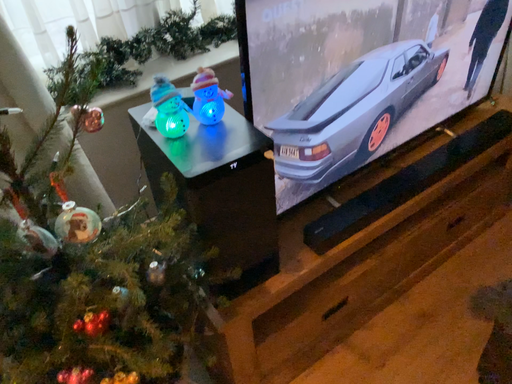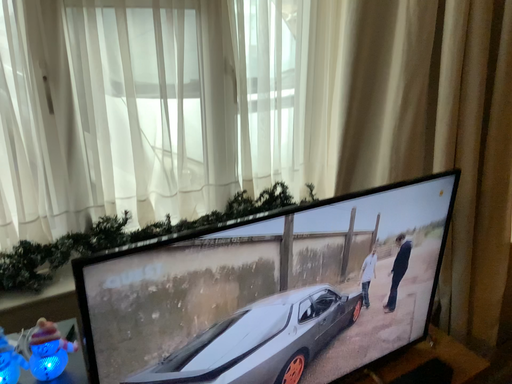
Question: How did the camera likely rotate when shooting the video?

Choices:
 (A) rotated upward
 (B) rotated downward

Answer: (A)